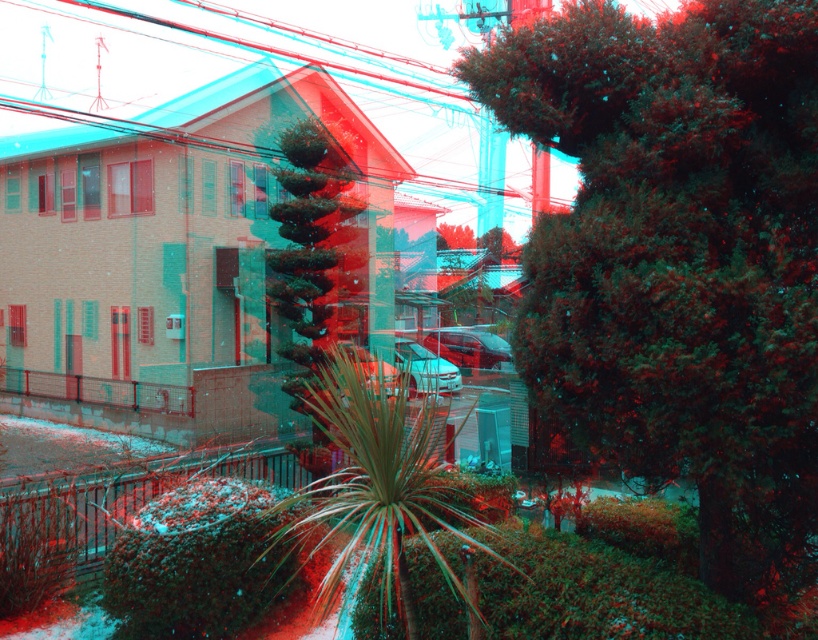
Question: Which of the following is the farthest from the observer?

Choices:
 (A) (427, 428)
 (B) (704, 285)
 (C) (288, 221)

Answer: (C)

Question: Does green leafy plant at center appear over green textured plant at center?

Choices:
 (A) yes
 (B) no

Answer: (B)

Question: Which point appears farthest from the camera in this image?

Choices:
 (A) (398, 428)
 (B) (300, 374)

Answer: (B)

Question: Is the position of green leafy plant at center less distant than that of green textured plant at center?

Choices:
 (A) yes
 (B) no

Answer: (A)

Question: Considering the real-world distances, which object is closest to the green textured bush at center?

Choices:
 (A) green fuzzy bush at lower center
 (B) green textured plant at center

Answer: (A)

Question: Is green textured bush at center closer to camera compared to green textured plant at center?

Choices:
 (A) yes
 (B) no

Answer: (A)